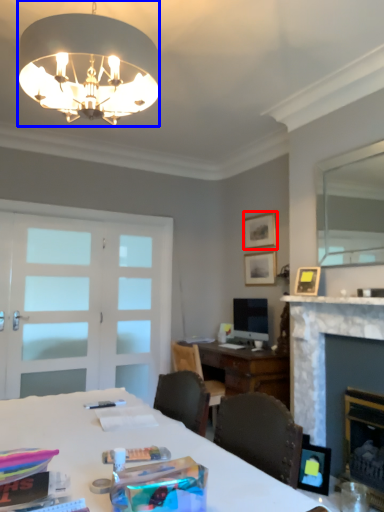
Question: Which point is closer to the camera, picture frame (highlighted by a red box) or lamp (highlighted by a blue box)?

Choices:
 (A) picture frame
 (B) lamp

Answer: (B)